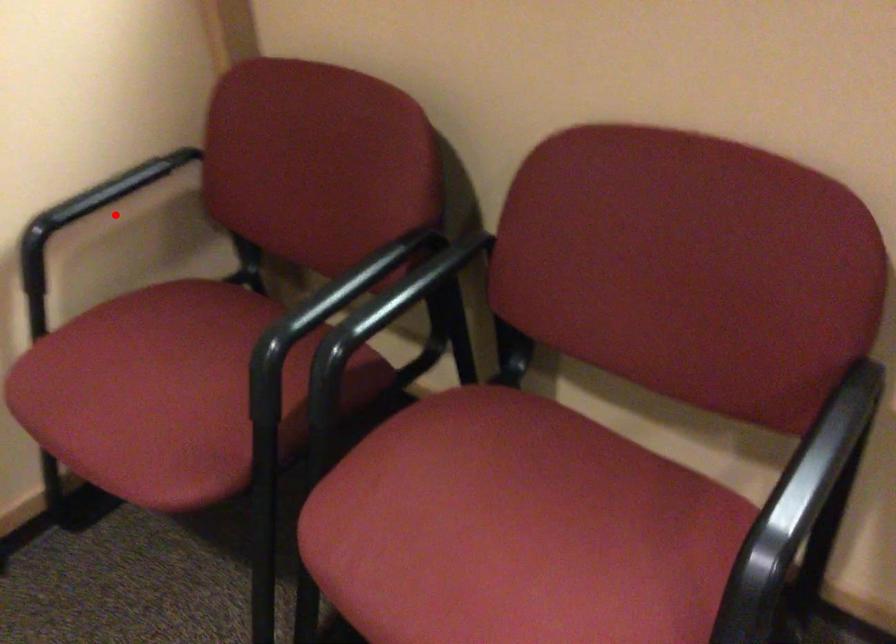
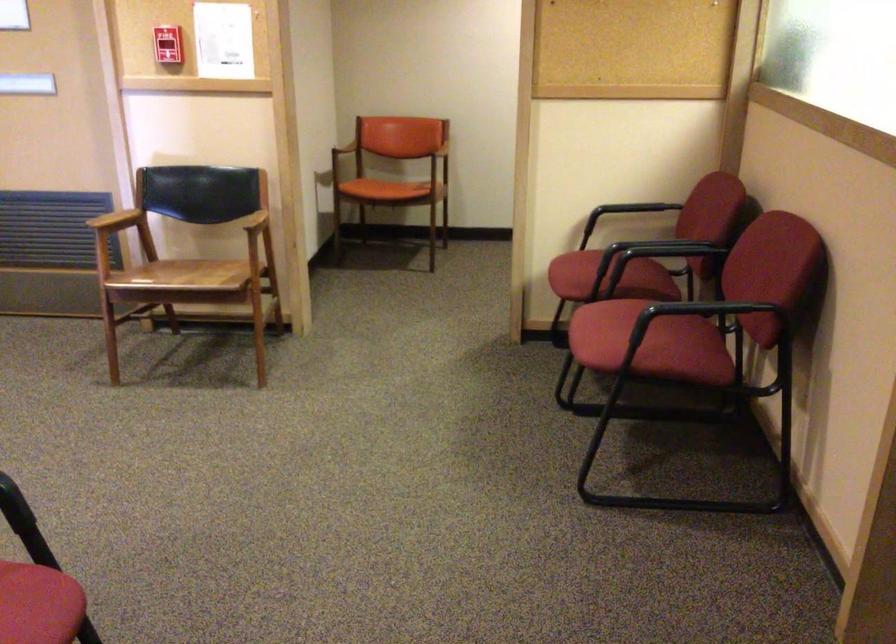
Find the pixel in the second image that matches the highlighted location in the first image.

(625, 211)